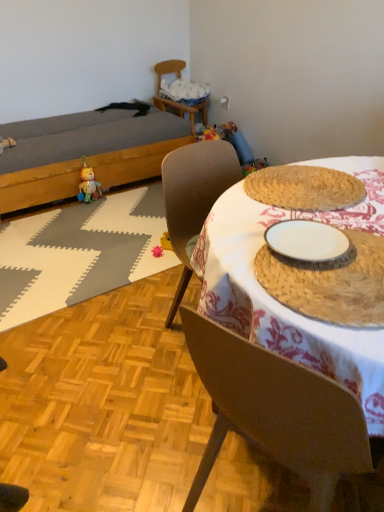
The image size is (384, 512). I want to click on free point behind pink rubber toy at center, positioned as the first toy in bottom-to-top order, so click(145, 239).